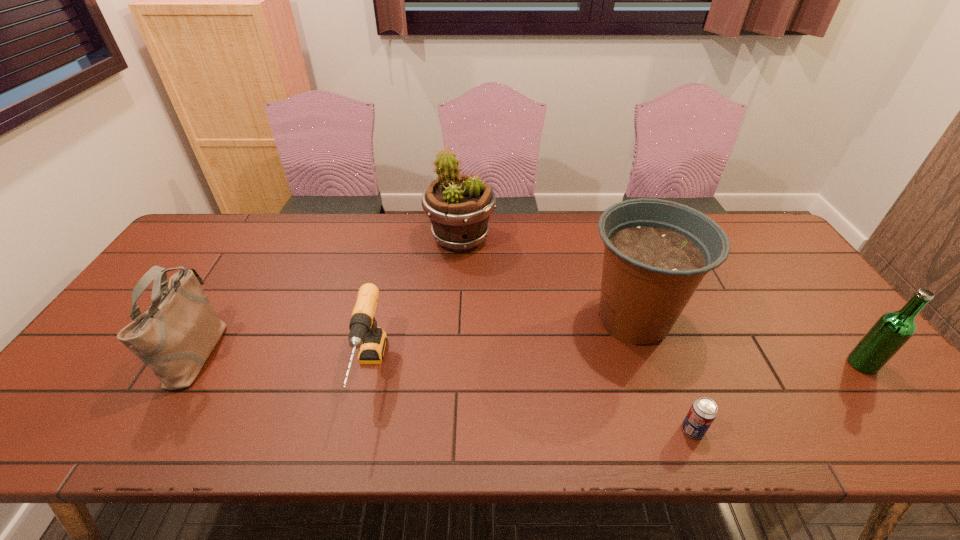
Point out which object is positioned as the nearest to the leftmost object. Please provide its 2D coordinates. Your answer should be formatted as a tuple, i.e. [(x, y)], where the tuple contains the x and y coordinates of a point satisfying the conditions above.

[(364, 334)]

Locate which object is the third closest to the right flowerpot. Please provide its 2D coordinates. Your answer should be formatted as a tuple, i.e. [(x, y)], where the tuple contains the x and y coordinates of a point satisfying the conditions above.

[(892, 330)]

This screenshot has width=960, height=540. Find the location of `free space in the image that satisfies the following two spatial constraints: 1. on the handle side of the shortest object; 2. on the right side of the second shortest object`. free space in the image that satisfies the following two spatial constraints: 1. on the handle side of the shortest object; 2. on the right side of the second shortest object is located at coordinates (356, 430).

Image resolution: width=960 pixels, height=540 pixels. Find the location of `vacant area that satisfies the following two spatial constraints: 1. on the front side of the rightmost object; 2. on the right side of the farthest object`. vacant area that satisfies the following two spatial constraints: 1. on the front side of the rightmost object; 2. on the right side of the farthest object is located at coordinates (453, 364).

The image size is (960, 540). In order to click on vacant space that satisfies the following two spatial constraints: 1. on the front-facing side of the shoulder bag; 2. on the left side of the rightmost object in this screenshot , I will do `click(191, 364)`.

This screenshot has width=960, height=540. Identify the location of vacant space that satisfies the following two spatial constraints: 1. on the back side of the shortest object; 2. on the front-facing side of the leftmost object. (662, 351).

Identify the location of vacant space that satisfies the following two spatial constraints: 1. on the front-facing side of the beer bottle; 2. on the left side of the shoulder bag. (191, 364).